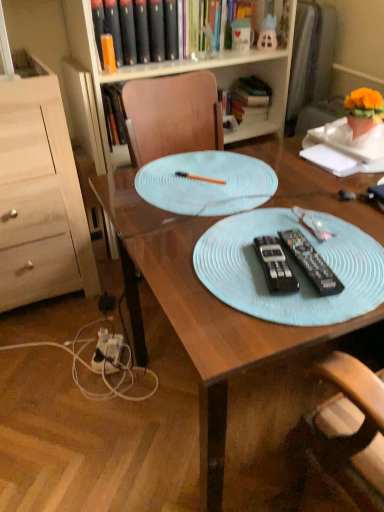
The height and width of the screenshot is (512, 384). What are the coordinates of `free space that is in between orange fabric flower pot at upper right and black plastic remote control at center, the 2th remote control positioned from the left` in the screenshot? It's located at (336, 204).